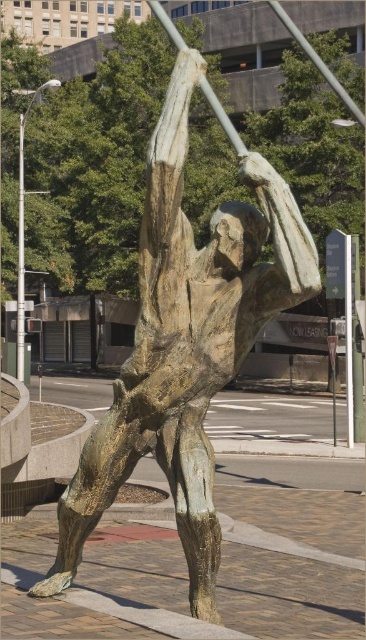
You are an art student analyzing the bronze sculpture of the male figure in mid action. The sculpture has a specific point at coordinates (185,342). Can you determine if this point is located on the bronze statue itself or somewhere else in the scene?

The point (185,342) is on bronze statue at center, so the point is located on the bronze statue itself.

You are an art student analyzing the sculpture. You notice the bronze statue at center and the smooth white pole at upper center. From the front view, which object appears closer to you?

The bronze statue at center appears closer because the smooth white pole at upper center is positioned behind it.

You are an art installer who needs to ensure the bronze statue at center and the smooth white pole at upper center are positioned correctly. According to the safety guidelines, the distance between them must be at least 3 meters. Can you confirm if the current placement meets the requirement?

The bronze statue at center is 3.18 meters from the smooth white pole at upper center, which exceeds the minimum required distance of 3 meters. Therefore, the current placement meets the safety guidelines.